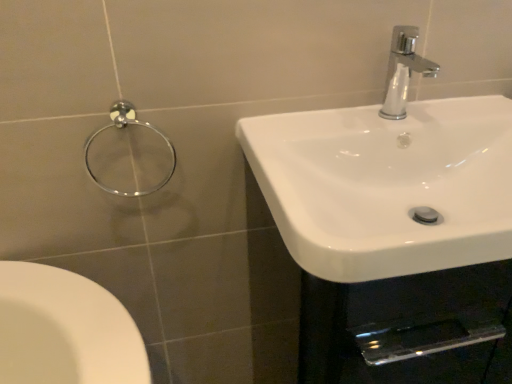
This screenshot has height=384, width=512. Describe the element at coordinates (403, 71) in the screenshot. I see `chrome metallic faucet at upper right` at that location.

Find the location of a particular element. chrome metallic faucet at upper right is located at coordinates (403, 71).

From a real-world perspective, between chrome metallic faucet at upper right and white glossy sink at right, who is vertically higher?

chrome metallic faucet at upper right is physically above.

Which object is thinner, chrome metallic faucet at upper right or white glossy sink at right?

Thinner between the two is chrome metallic faucet at upper right.

Is point (413, 64) farther from viewer compared to point (448, 170)?

No, (413, 64) is closer to viewer.

From the picture: From the image's perspective, which one is positioned lower, chrome metallic faucet at upper right or white glossy sink at right?

white glossy sink at right.

Which point is more distant from viewer, (x=407, y=76) or (x=122, y=124)?

Point (x=407, y=76)

Does chrome metallic faucet at upper right have a larger size compared to chrome metallic towel ring at upper left?

Incorrect, chrome metallic faucet at upper right is not larger than chrome metallic towel ring at upper left.

From the image's perspective, does chrome metallic faucet at upper right appear lower than chrome metallic towel ring at upper left?

Incorrect, from the image's perspective, chrome metallic faucet at upper right is higher than chrome metallic towel ring at upper left.

Considering the relative positions of chrome metallic faucet at upper right and chrome metallic towel ring at upper left in the image provided, is chrome metallic faucet at upper right in front of chrome metallic towel ring at upper left?

Yes, it is in front of chrome metallic towel ring at upper left.

From a real-world perspective, is white glossy sink at right positioned under chrome metallic towel ring at upper left based on gravity?

Yes.

What's the angular difference between white glossy sink at right and chrome metallic towel ring at upper left's facing directions?

0.0229 degrees separate the facing orientations of white glossy sink at right and chrome metallic towel ring at upper left.

Is there a large distance between white glossy sink at right and chrome metallic towel ring at upper left?

white glossy sink at right is near chrome metallic towel ring at upper left, not far away.

Considering the sizes of objects white glossy sink at right and chrome metallic towel ring at upper left in the image provided, who is bigger, white glossy sink at right or chrome metallic towel ring at upper left?

Bigger between the two is white glossy sink at right.

How different are the orientations of white glossy sink at right and chrome metallic faucet at upper right in degrees?

They differ by 0.00459 degrees in their facing directions.

Is point (490, 245) positioned after point (417, 70)?

No, it is not.

Is white glossy sink at right oriented towards chrome metallic faucet at upper right?

No.

Is the position of white glossy sink at right less distant than that of chrome metallic faucet at upper right?

Yes, the depth of white glossy sink at right is less than that of chrome metallic faucet at upper right.

Is chrome metallic towel ring at upper left facing away from chrome metallic faucet at upper right?

chrome metallic towel ring at upper left is not turned away from chrome metallic faucet at upper right.

Is chrome metallic towel ring at upper left wider than chrome metallic faucet at upper right?

No.

Looking at this image, from the image's perspective, is chrome metallic towel ring at upper left located above or below chrome metallic faucet at upper right?

From the image's perspective, chrome metallic towel ring at upper left appears below chrome metallic faucet at upper right.

Is chrome metallic towel ring at upper left taller than white glossy sink at right?

Yes, chrome metallic towel ring at upper left is taller than white glossy sink at right.

Does chrome metallic towel ring at upper left have a smaller size compared to white glossy sink at right?

Yes.

Does chrome metallic towel ring at upper left appear on the left side of white glossy sink at right?

Correct, you'll find chrome metallic towel ring at upper left to the left of white glossy sink at right.

Does point (169, 149) come in front of point (285, 228)?

That is False.

Locate an element on the screen. The width and height of the screenshot is (512, 384). sink in front of the chrome metallic faucet at upper right is located at coordinates (388, 179).

Find the location of a particular element. Image resolution: width=512 pixels, height=384 pixels. tap above the chrome metallic towel ring at upper left (from the image's perspective) is located at coordinates (403, 71).

When comparing their distances from chrome metallic faucet at upper right, does chrome metallic towel ring at upper left or white glossy sink at right seem further?

chrome metallic towel ring at upper left.

From the image, which object appears to be farther from chrome metallic towel ring at upper left, white glossy sink at right or chrome metallic faucet at upper right?

Among the two, chrome metallic faucet at upper right is located further to chrome metallic towel ring at upper left.

Which object lies further to the anchor point chrome metallic towel ring at upper left, chrome metallic faucet at upper right or white glossy sink at right?

Among the two, chrome metallic faucet at upper right is located further to chrome metallic towel ring at upper left.

From the image, which object appears to be nearer to chrome metallic faucet at upper right, white glossy sink at right or chrome metallic towel ring at upper left?

white glossy sink at right is positioned closer to the anchor chrome metallic faucet at upper right.

Based on their spatial positions, is chrome metallic towel ring at upper left or chrome metallic faucet at upper right closer to white glossy sink at right?

chrome metallic faucet at upper right lies closer to white glossy sink at right than the other object.

Estimate the real-world distances between objects in this image. Which object is further from white glossy sink at right, chrome metallic faucet at upper right or chrome metallic towel ring at upper left?

Among the two, chrome metallic towel ring at upper left is located further to white glossy sink at right.

Image resolution: width=512 pixels, height=384 pixels. Find the location of `tap between chrome metallic towel ring at upper left and white glossy sink at right in the horizontal direction`. tap between chrome metallic towel ring at upper left and white glossy sink at right in the horizontal direction is located at coordinates (403, 71).